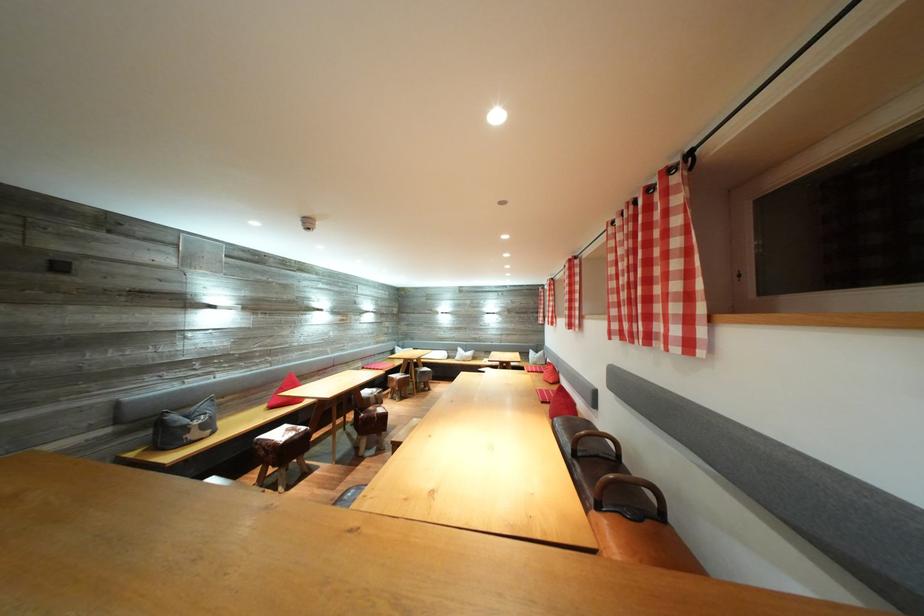
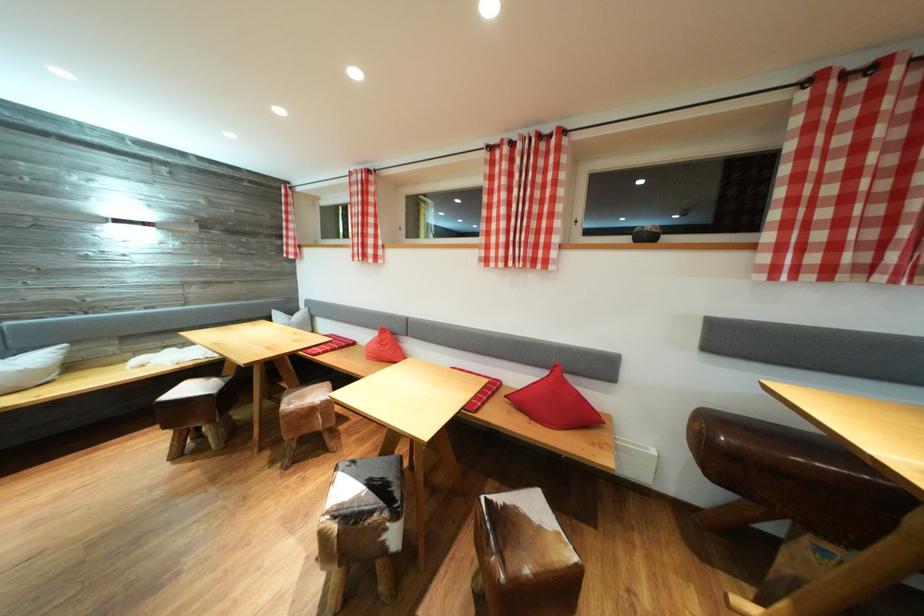
In the second image, find the point that corresponds to the point at 472,355 in the first image.

(14, 358)